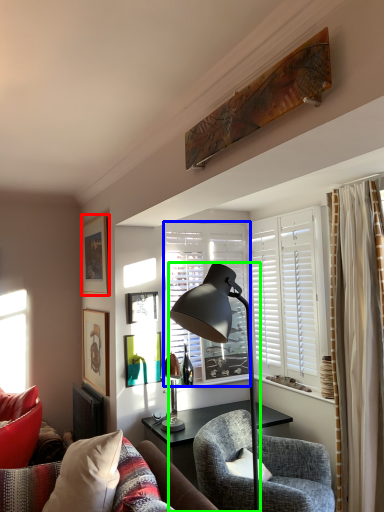
Question: Based on their relative distances, which object is farther from picture frame (highlighted by a red box)? Choose from window (highlighted by a blue box) and lamp (highlighted by a green box).

Choices:
 (A) window
 (B) lamp

Answer: (B)